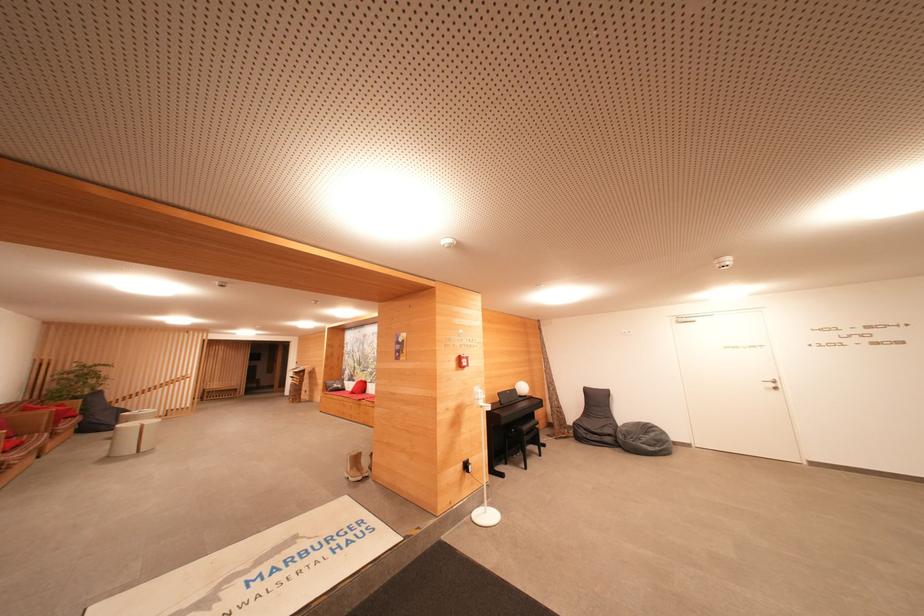
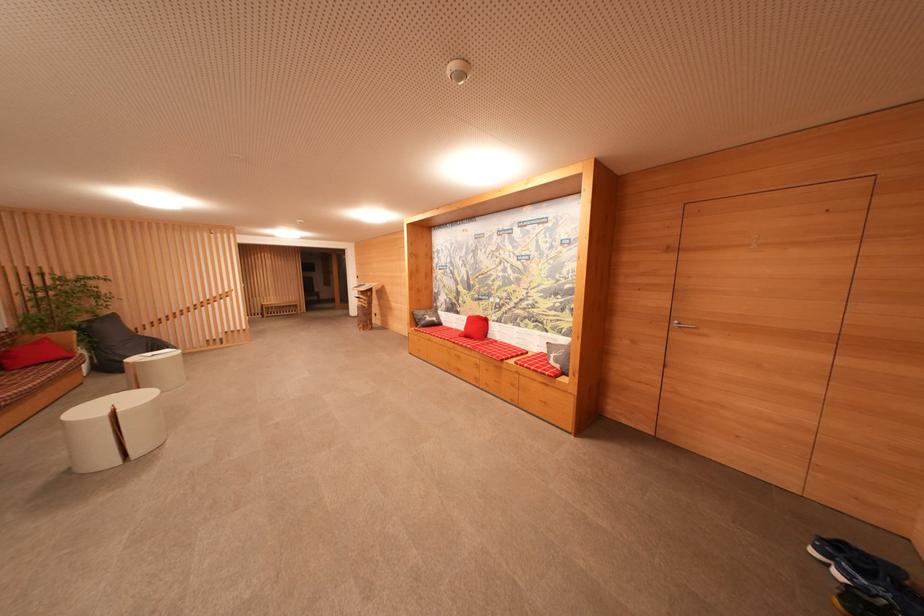
Find the pixel in the second image that matches [339,389] in the first image.

(432, 322)